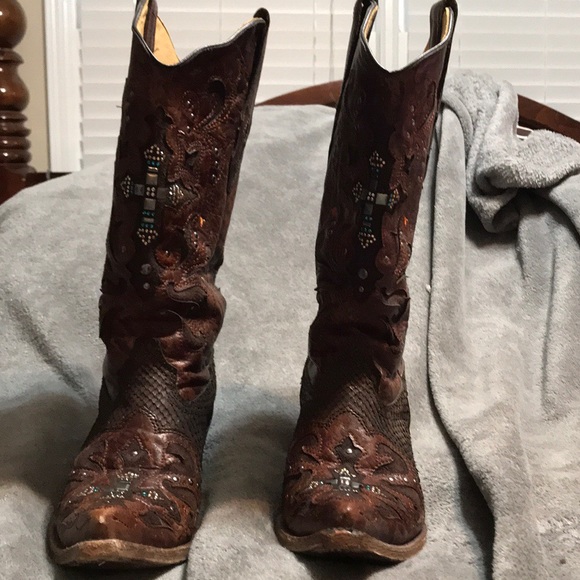
What are the coordinates of `headboard` in the screenshot? It's located at (317, 97), (554, 113).